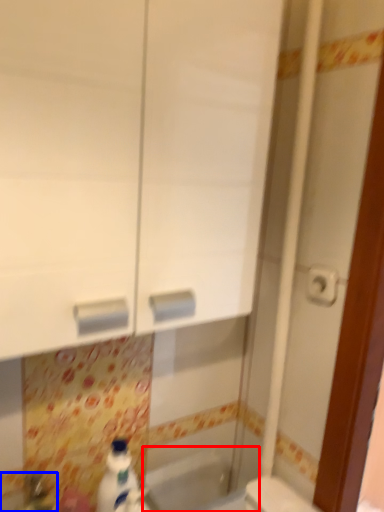
Question: Among these objects, which one is nearest to the camera, bath (highlighted by a red box) or sink (highlighted by a blue box)?

Choices:
 (A) bath
 (B) sink

Answer: (B)